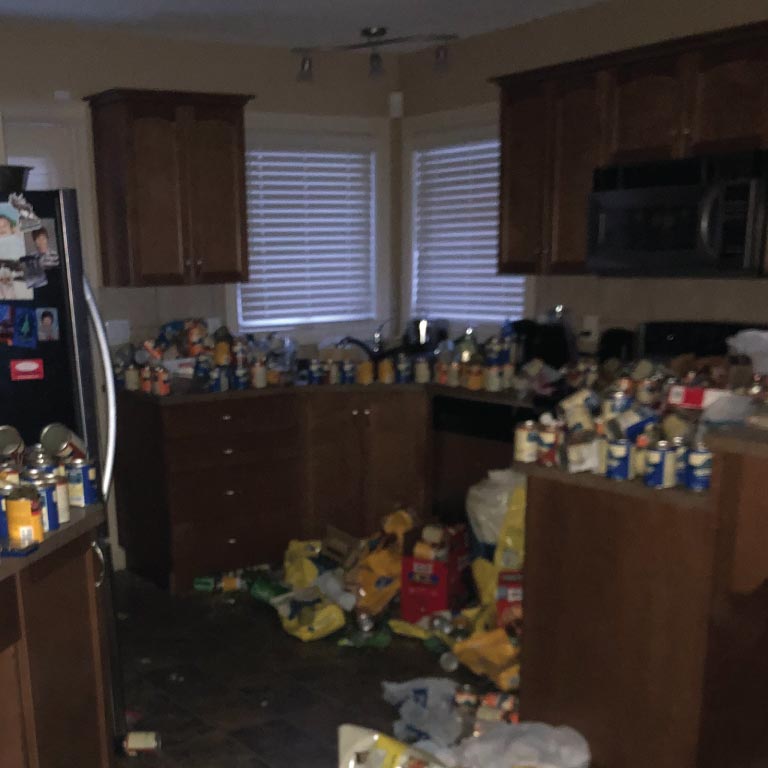
I want to click on images on side of fridge, so click(x=51, y=319), click(x=50, y=229), click(x=7, y=232).